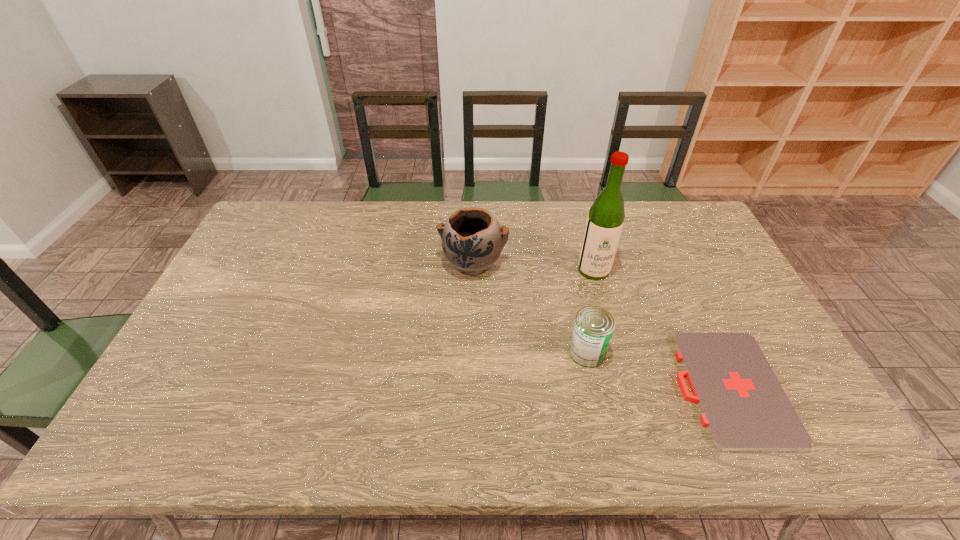
This screenshot has width=960, height=540. Find the location of `vacant space located on handle side the first-aid kit`. vacant space located on handle side the first-aid kit is located at coordinates click(615, 389).

What are the coordinates of `vacant area situated 0.400m on handle side the first-aid kit` in the screenshot? It's located at (518, 389).

Locate an element on the screen. This screenshot has height=540, width=960. object present at the near edge is located at coordinates pyautogui.click(x=743, y=406).

Identify the location of object located at the right edge. The image size is (960, 540). point(743,406).

This screenshot has height=540, width=960. Find the location of `object positioned at the near right corner`. object positioned at the near right corner is located at coordinates (743, 406).

Identify the location of free spot at the far edge of the desktop. (380, 240).

In order to click on vacant area at the near edge of the desktop in this screenshot , I will do `click(418, 449)`.

Image resolution: width=960 pixels, height=540 pixels. I want to click on free point at the left edge, so pos(268,293).

The height and width of the screenshot is (540, 960). In the image, there is a desktop. Find the location of `vacant space at the right edge`. vacant space at the right edge is located at coordinates (722, 315).

In order to click on vacant space at the far left corner of the desktop in this screenshot , I will do `click(291, 215)`.